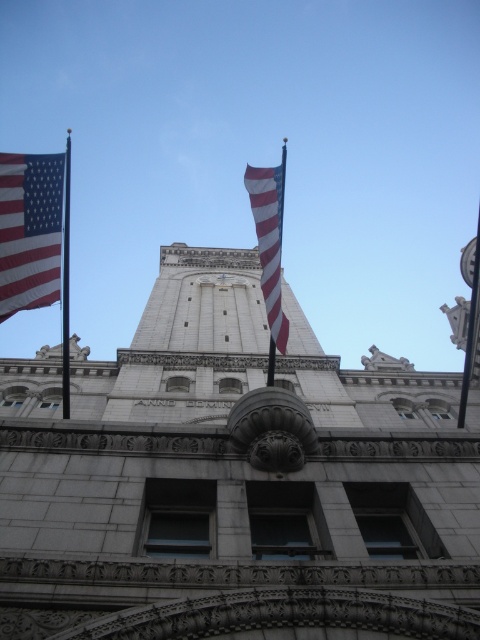
Find the location of `matte fabric flag at left`. matte fabric flag at left is located at coordinates (29, 230).

Does matte fabric flag at left have a larger size compared to polished metal flag pole at left?

Incorrect, matte fabric flag at left is not larger than polished metal flag pole at left.

Identify the location of matte fabric flag at left. The image size is (480, 640). (29, 230).

The height and width of the screenshot is (640, 480). Find the location of `matte fabric flag at left`. matte fabric flag at left is located at coordinates (29, 230).

Does white stone tower at center appear over polished metal flag pole at left?

No, white stone tower at center is not above polished metal flag pole at left.

Does white stone tower at center come behind polished metal flag pole at left?

That is False.

Is point (340, 445) more distant than point (67, 256)?

No, (340, 445) is closer to viewer.

Locate an element on the screen. white stone tower at center is located at coordinates (235, 481).

Which is in front, point (252, 204) or point (68, 161)?

Point (252, 204)

Who is more distant from viewer, (x=275, y=266) or (x=68, y=394)?

The point (x=68, y=394) is more distant.

What are the coordinates of `matte fabric flag at center` in the screenshot? It's located at (269, 243).